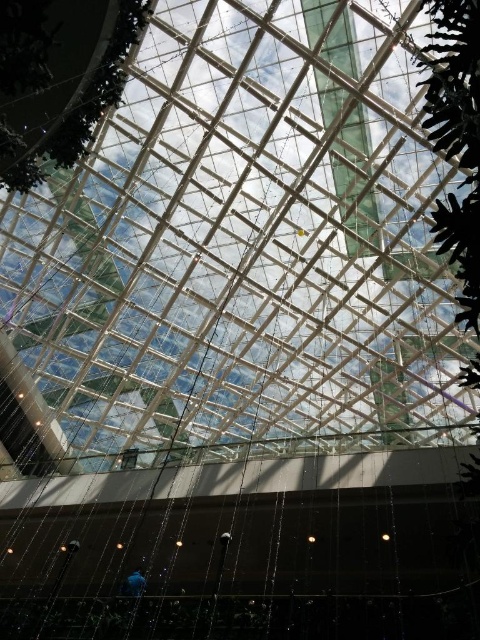
Which is in front, point (36, 154) or point (429, 140)?

Positioned in front is point (36, 154).

Is point (3, 147) closer to viewer compared to point (437, 80)?

No, it is behind (437, 80).

Identify the location of green leafy tree at upper center. (59, 77).

Is point (145, 332) in front of point (465, 280)?

No, (145, 332) is behind (465, 280).

Is point (382, 211) positioned after point (434, 12)?

Yes, point (382, 211) is farther from viewer.

Find the location of a particular element. transparent glass roof at center is located at coordinates (240, 248).

Between point (391, 264) and point (122, 42), which one is positioned behind?

The point (391, 264) is more distant.

At what (x,y) coordinates should I click in order to perform the action: click on transparent glass roof at center. Please return your answer as a coordinate pair (x, y). The width and height of the screenshot is (480, 640). Looking at the image, I should click on (240, 248).